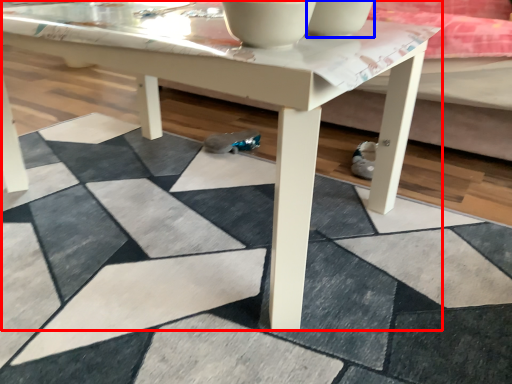
Question: Which of the following is the farthest to the observer, coffee table (highlighted by a red box) or bowl (highlighted by a blue box)?

Choices:
 (A) coffee table
 (B) bowl

Answer: (B)